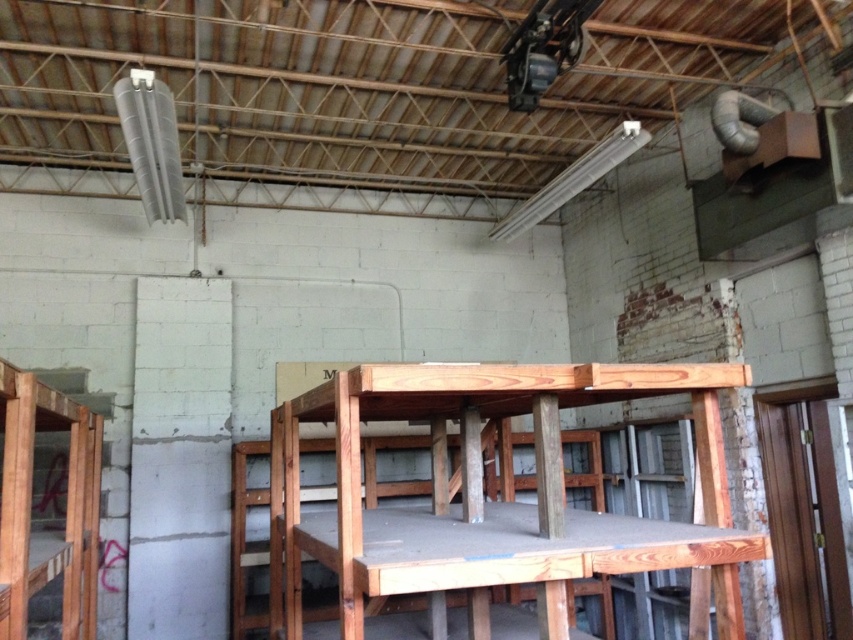
Question: Is natural wood table at center below wooden bunk bed at left?

Choices:
 (A) no
 (B) yes

Answer: (A)

Question: Which point is closer to the camera?

Choices:
 (A) natural wood table at center
 (B) wooden bunk bed at left

Answer: (A)

Question: Is natural wood table at center wider than wooden bunk bed at left?

Choices:
 (A) no
 (B) yes

Answer: (B)

Question: From the image, what is the correct spatial relationship of natural wood table at center in relation to wooden bunk bed at left?

Choices:
 (A) left
 (B) right

Answer: (B)

Question: Which of the following is the closest to the observer?

Choices:
 (A) natural wood table at center
 (B) wooden bunk bed at left

Answer: (A)